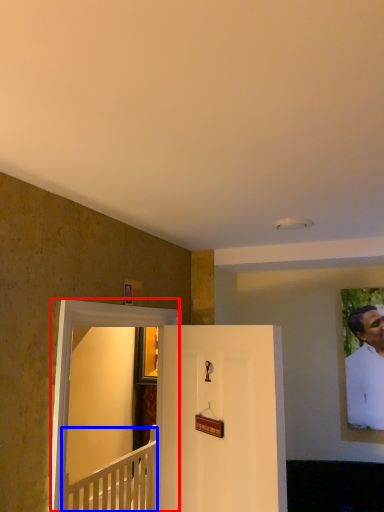
Question: Which object is closer to the camera taking this photo, glass door (highlighted by a red box) or furniture (highlighted by a blue box)?

Choices:
 (A) glass door
 (B) furniture

Answer: (A)